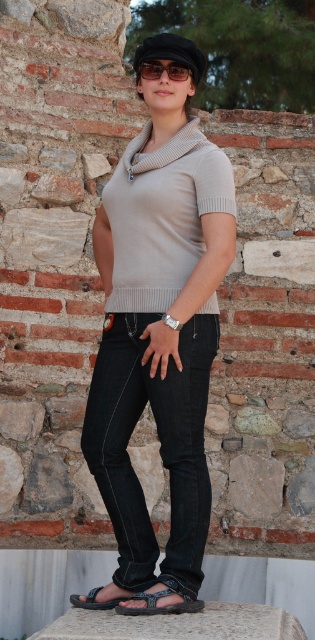
Question: Which point is closer to the camera?

Choices:
 (A) dark blue denim jeans at center
 (B) black textured sandal at lower center

Answer: (B)

Question: Is dark blue denim jeans at center to the left of black matte sunglasses at center from the viewer's perspective?

Choices:
 (A) no
 (B) yes

Answer: (B)

Question: Which object is farther from the camera taking this photo?

Choices:
 (A) beige knitted sweater at center
 (B) black textured sandal at lower center
 (C) matte beige sweater at center

Answer: (A)

Question: Which point is closer to the camera?

Choices:
 (A) black leather sandal at lower center
 (B) dark blue denim jeans at center
 (C) beige knitted sweater at center

Answer: (B)

Question: Does matte beige sweater at center have a smaller size compared to beige knitted sweater at center?

Choices:
 (A) no
 (B) yes

Answer: (A)

Question: Can you confirm if beige knitted sweater at center is positioned above black leather sandal at lower center?

Choices:
 (A) no
 (B) yes

Answer: (B)